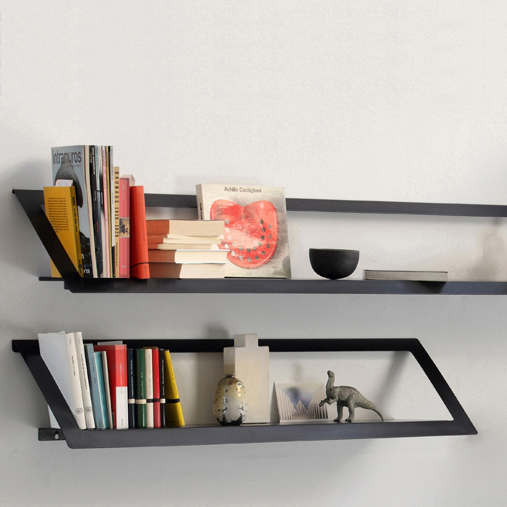
This screenshot has height=507, width=507. Identify the location of art. (345, 401), (301, 403), (257, 379), (229, 409), (330, 264).